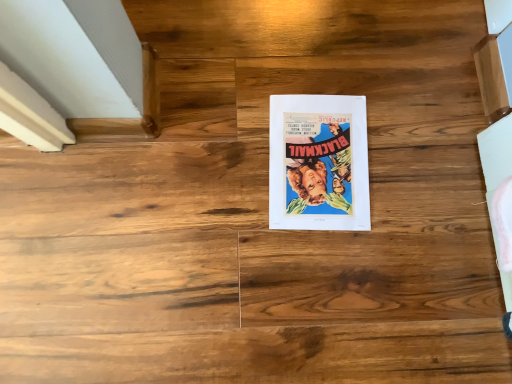
Find the location of a particular element. This screenshot has width=512, height=384. free space above vibrant paper poster at center (from a real-world perspective) is located at coordinates point(317,160).